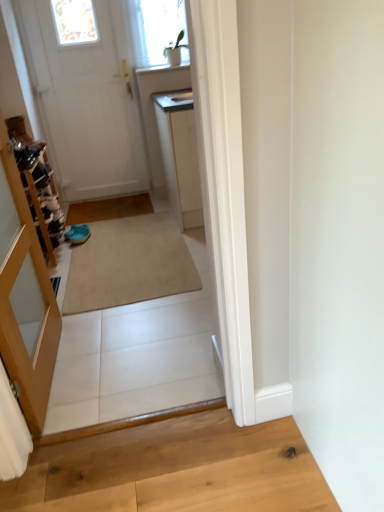
Find the location of `free spot above light brown wood at lower right (from a real-world perspective)`. free spot above light brown wood at lower right (from a real-world perspective) is located at coordinates (196, 488).